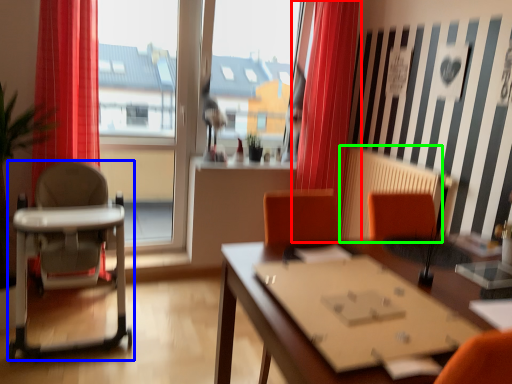
Question: Which object is the farthest from curtain (highlighted by a red box)? Choose among these: chair (highlighted by a blue box) or radiator (highlighted by a green box).

Choices:
 (A) chair
 (B) radiator

Answer: (A)